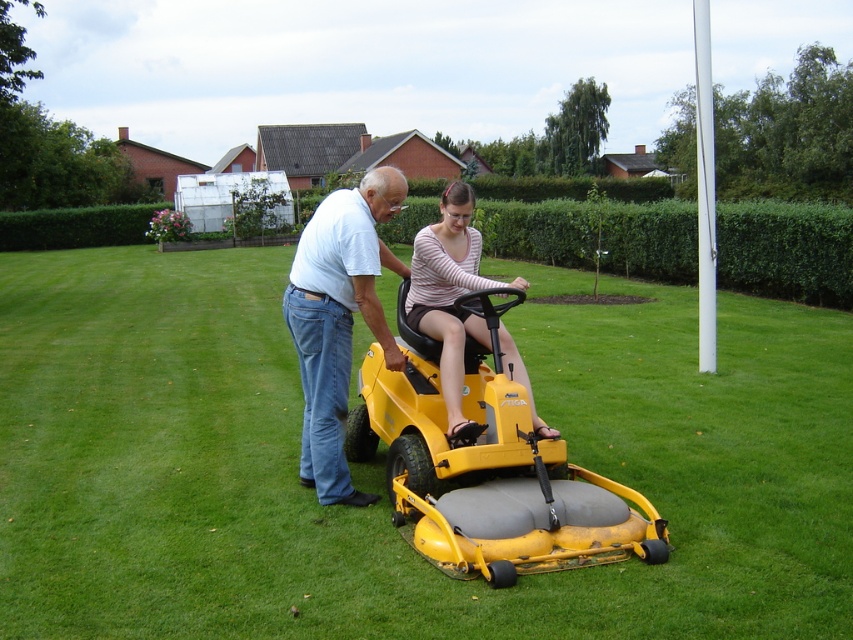
Can you confirm if green grass at center is taller than yellow matte lawn mower at center?

Indeed, green grass at center has a greater height compared to yellow matte lawn mower at center.

Locate an element on the screen. The width and height of the screenshot is (853, 640). green grass at center is located at coordinates (381, 465).

The image size is (853, 640). In order to click on green grass at center in this screenshot , I will do `click(381, 465)`.

Is green grass at center wider than white matte shirt at center?

Indeed, green grass at center has a greater width compared to white matte shirt at center.

Between green grass at center and white matte shirt at center, which one appears on the right side from the viewer's perspective?

white matte shirt at center is more to the right.

Describe the element at coordinates (381, 465) in the screenshot. This screenshot has height=640, width=853. I see `green grass at center` at that location.

Where is `green grass at center`? The height and width of the screenshot is (640, 853). green grass at center is located at coordinates (381, 465).

Can you confirm if yellow matte lawn mower at center is thinner than striped cotton shirt at center?

No.

Is point (403, 477) positioned after point (424, 268)?

No, (403, 477) is closer to viewer.

Identify the location of yellow matte lawn mower at center. Image resolution: width=853 pixels, height=640 pixels. (488, 467).